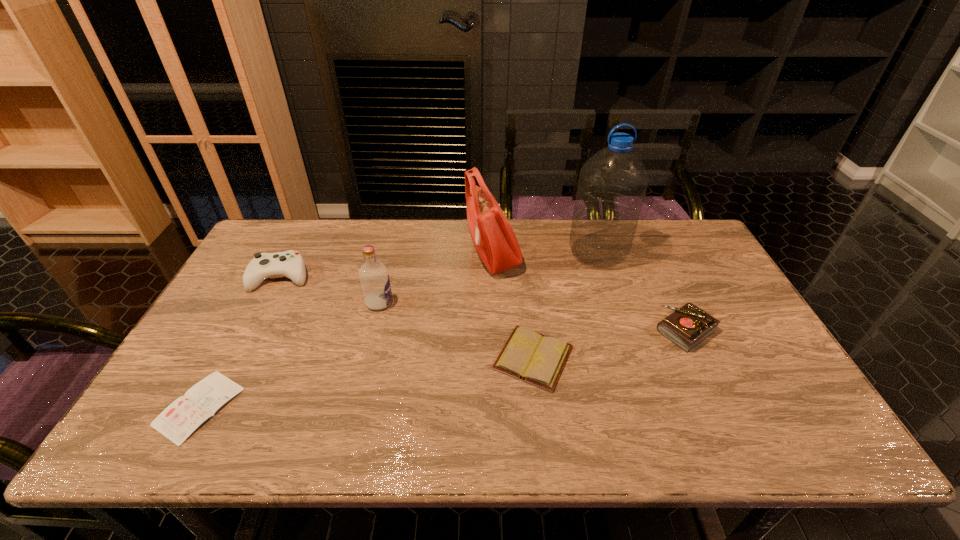
The width and height of the screenshot is (960, 540). What are the coordinates of `free space that satisfies the following two spatial constraints: 1. on the front-facing side of the sixth shortest object; 2. on the back side of the fifth tallest object` in the screenshot? It's located at (495, 330).